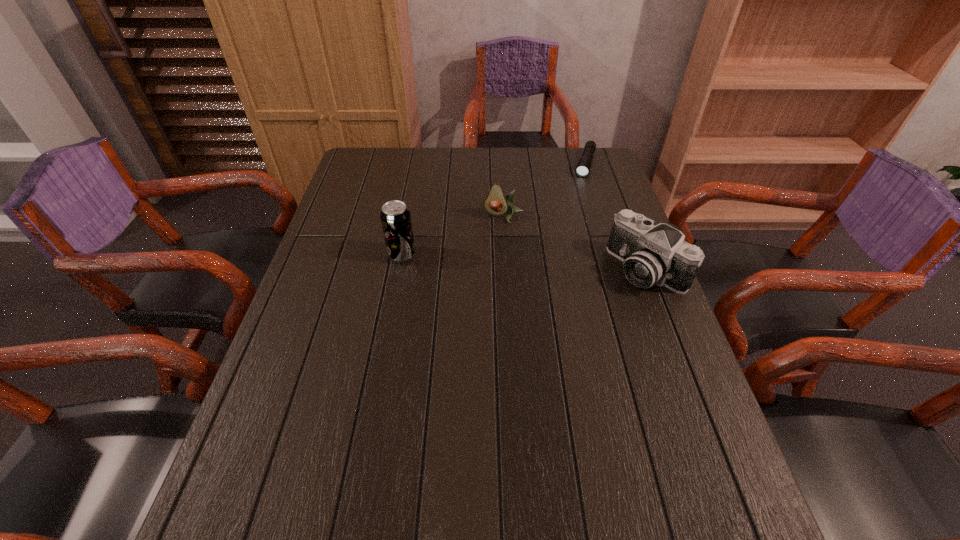
Where is `free spot on the desktop that is between the soda can and the camera and is positioned at the lens end of the farthest object`? Image resolution: width=960 pixels, height=540 pixels. free spot on the desktop that is between the soda can and the camera and is positioned at the lens end of the farthest object is located at coordinates (552, 264).

You are a GUI agent. You are given a task and a screenshot of the screen. Output one action in this format:
    pyautogui.click(x=<x>, y=<y>)
    Task: Click on the vacant space on the desktop that is between the leftmost object and the camera and is positioned on the seed side of the avocado
    
    Given the screenshot: What is the action you would take?
    pyautogui.click(x=492, y=260)